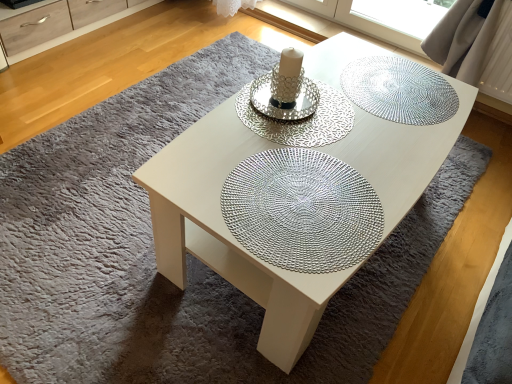
Question: Is silver textured doily at center, the first glass plate in the front-to-back sequence, oriented towards matte wood dresser at upper left?

Choices:
 (A) yes
 (B) no

Answer: (B)

Question: Does silver textured doily at center, the first glass plate in the front-to-back sequence, have a greater height compared to matte wood dresser at upper left?

Choices:
 (A) yes
 (B) no

Answer: (B)

Question: Considering the relative sizes of silver textured doily at center, the first glass plate in the front-to-back sequence, and matte wood dresser at upper left in the image provided, is silver textured doily at center, the first glass plate in the front-to-back sequence, thinner than matte wood dresser at upper left?

Choices:
 (A) no
 (B) yes

Answer: (B)

Question: Does silver textured doily at center, the first glass plate in the front-to-back sequence, have a larger size compared to matte wood dresser at upper left?

Choices:
 (A) no
 (B) yes

Answer: (A)

Question: From a real-world perspective, is silver textured doily at center, the first glass plate in the front-to-back sequence, on top of matte wood dresser at upper left?

Choices:
 (A) no
 (B) yes

Answer: (B)

Question: Would you consider silver textured doily at center, the first glass plate in the front-to-back sequence, to be distant from matte wood dresser at upper left?

Choices:
 (A) yes
 (B) no

Answer: (A)

Question: Could you tell me if matte wood dresser at upper left is turned towards white glossy coffee table at center?

Choices:
 (A) yes
 (B) no

Answer: (A)

Question: Is matte wood dresser at upper left taller than white glossy coffee table at center?

Choices:
 (A) yes
 (B) no

Answer: (B)

Question: Is matte wood dresser at upper left directly adjacent to white glossy coffee table at center?

Choices:
 (A) yes
 (B) no

Answer: (B)

Question: Is matte wood dresser at upper left bigger than white glossy coffee table at center?

Choices:
 (A) yes
 (B) no

Answer: (B)

Question: From the image's perspective, is matte wood dresser at upper left under white glossy coffee table at center?

Choices:
 (A) yes
 (B) no

Answer: (B)

Question: Does matte wood dresser at upper left have a smaller size compared to white glossy coffee table at center?

Choices:
 (A) no
 (B) yes

Answer: (B)

Question: From a real-world perspective, is white glossy coffee table at center on matte wood dresser at upper left?

Choices:
 (A) no
 (B) yes

Answer: (B)